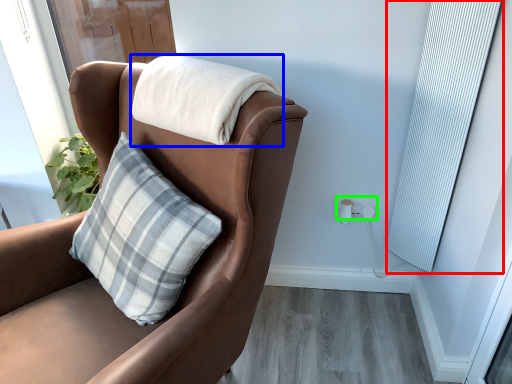
Question: Which object is the farthest from curtain (highlighted by a red box)? Choose among these: blanket (highlighted by a blue box) or electric outlet (highlighted by a green box).

Choices:
 (A) blanket
 (B) electric outlet

Answer: (A)